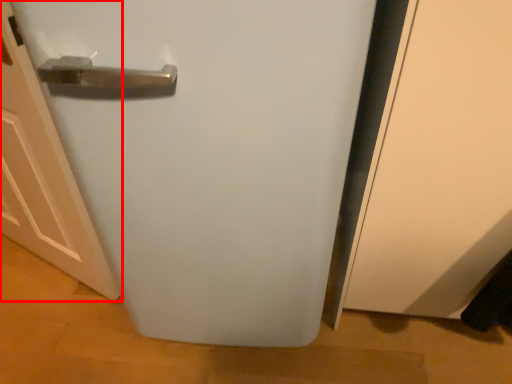
Question: In this image, where is door (annotated by the red box) located relative to refrigerator?

Choices:
 (A) left
 (B) right

Answer: (A)